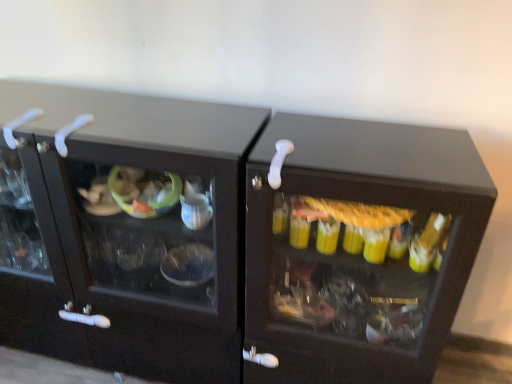
Question: Is white plastic door handle at upper left, acting as the 1th door handle starting from the left, to the right of white plastic door handle at center, arranged as the first door handle when viewed from the right, from the viewer's perspective?

Choices:
 (A) no
 (B) yes

Answer: (A)

Question: From a real-world perspective, is white plastic door handle at upper left, acting as the 1th door handle starting from the left, located higher than white plastic door handle at center, arranged as the first door handle when viewed from the right?

Choices:
 (A) yes
 (B) no

Answer: (A)

Question: Can you confirm if white plastic door handle at upper left, placed as the 3th door handle when sorted from right to left, is smaller than white plastic door handle at center, arranged as the first door handle when viewed from the right?

Choices:
 (A) yes
 (B) no

Answer: (B)

Question: Is white plastic door handle at center, the 3th door handle when ordered from left to right, located within white plastic door handle at upper left, placed as the 3th door handle when sorted from right to left?

Choices:
 (A) no
 (B) yes

Answer: (A)

Question: From a real-world perspective, is white plastic door handle at upper left, placed as the 3th door handle when sorted from right to left, below white plastic door handle at center, arranged as the first door handle when viewed from the right?

Choices:
 (A) no
 (B) yes

Answer: (A)

Question: From a real-world perspective, is white plastic door handle at upper left, placed as the 3th door handle when sorted from right to left, above or below white plastic door handle at center, the 3th door handle when ordered from left to right?

Choices:
 (A) above
 (B) below

Answer: (A)

Question: Visually, is white plastic door handle at upper left, acting as the 1th door handle starting from the left, positioned to the left or to the right of white plastic door handle at center, arranged as the first door handle when viewed from the right?

Choices:
 (A) left
 (B) right

Answer: (A)

Question: Is point (20, 144) positioned closer to the camera than point (282, 145)?

Choices:
 (A) farther
 (B) closer

Answer: (A)

Question: Is white plastic door handle at upper left, placed as the 3th door handle when sorted from right to left, in front of or behind white plastic door handle at center, arranged as the first door handle when viewed from the right, in the image?

Choices:
 (A) behind
 (B) front

Answer: (A)

Question: Is point (70, 130) closer or farther from the camera than point (281, 145)?

Choices:
 (A) closer
 (B) farther

Answer: (B)

Question: Based on their positions, is white plastic door handle at upper left, the 2th door handle positioned from the right, located to the left or right of white plastic door handle at center, arranged as the first door handle when viewed from the right?

Choices:
 (A) left
 (B) right

Answer: (A)

Question: From a real-world perspective, is white plastic door handle at upper left, the 2th door handle positioned from the right, physically located above or below white plastic door handle at center, the 3th door handle when ordered from left to right?

Choices:
 (A) below
 (B) above

Answer: (B)

Question: In terms of height, does white plastic door handle at upper left, the 2th door handle positioned from the right, look taller or shorter compared to white plastic door handle at center, the 3th door handle when ordered from left to right?

Choices:
 (A) short
 (B) tall

Answer: (B)

Question: Is white plastic door handle at center, arranged as the first door handle when viewed from the right, wider or thinner than white plastic door handle at upper left, the 2th door handle positioned from the right?

Choices:
 (A) wide
 (B) thin

Answer: (A)

Question: Is white plastic door handle at center, arranged as the first door handle when viewed from the right, in front of or behind white plastic door handle at upper left, the 2th door handle positioned from the right, in the image?

Choices:
 (A) behind
 (B) front

Answer: (B)